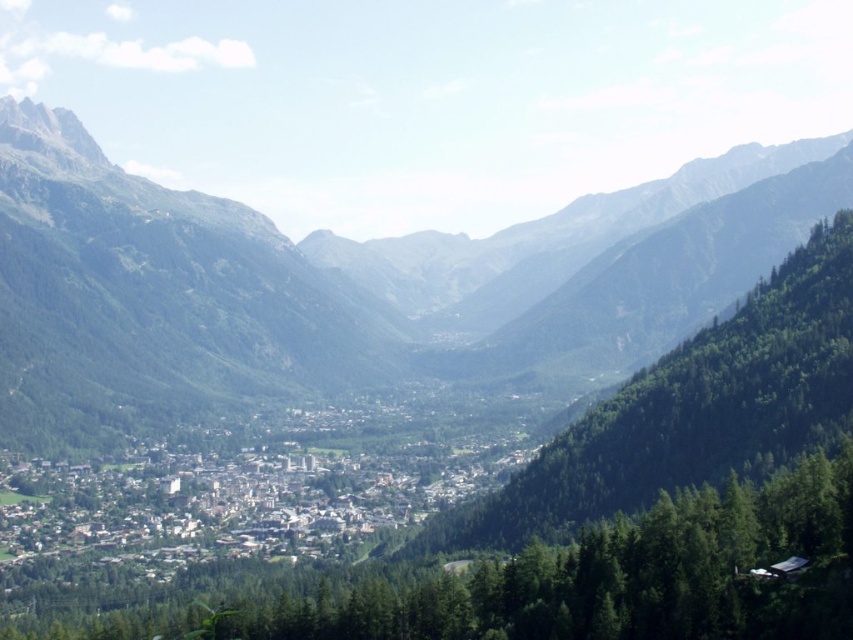
Question: Which point is closer to the camera?

Choices:
 (A) green leafy trees at center
 (B) green textured trees at center

Answer: (B)

Question: Which is farther from the green forested mountain at center?

Choices:
 (A) green leafy trees at center
 (B) green textured trees at center

Answer: (B)

Question: Estimate the real-world distances between objects in this image. Which object is farther from the green textured trees at center?

Choices:
 (A) green forested mountain at center
 (B) green leafy trees at center

Answer: (A)

Question: Does green forested mountain at center appear under green textured trees at center?

Choices:
 (A) yes
 (B) no

Answer: (B)

Question: Can you confirm if green textured trees at center is positioned to the left of green leafy trees at center?

Choices:
 (A) yes
 (B) no

Answer: (A)

Question: Is green forested mountain at center bigger than green textured trees at center?

Choices:
 (A) no
 (B) yes

Answer: (B)